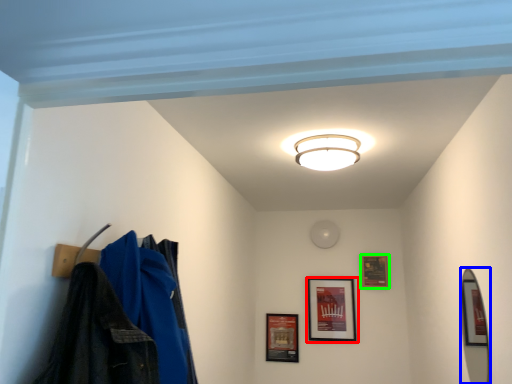
Question: Which is nearer to the picture frame (highlighted by a red box)? mirror (highlighted by a blue box) or picture frame (highlighted by a green box).

Choices:
 (A) mirror
 (B) picture frame

Answer: (B)